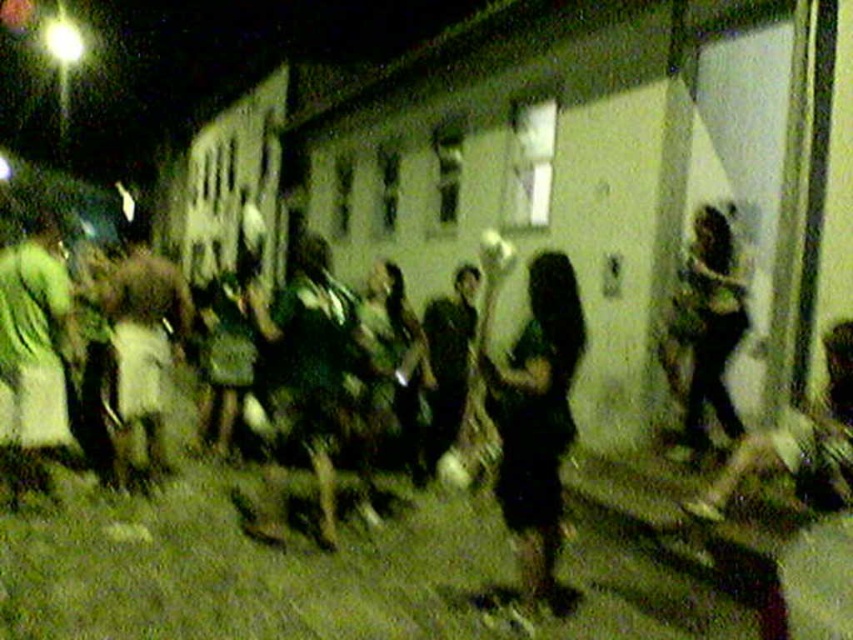
Question: Does green fabric dress at left have a smaller size compared to dark green fabric shirt at center?

Choices:
 (A) no
 (B) yes

Answer: (A)

Question: Estimate the real-world distances between objects in this image. Which object is farther from the green fabric shirt at center?

Choices:
 (A) green fabric dress at left
 (B) dark green fabric at center

Answer: (A)

Question: Can you confirm if green fabric shirt at center is positioned to the right of green fabric dress at left?

Choices:
 (A) no
 (B) yes

Answer: (B)

Question: Which object is farther from the camera taking this photo?

Choices:
 (A) green fabric shirt at center
 (B) dark green fabric at center
 (C) brown fabric shorts at left

Answer: (C)

Question: Is green fabric shirt at center wider than green fabric dress at left?

Choices:
 (A) no
 (B) yes

Answer: (A)

Question: Considering the real-world distances, which object is closest to the dark green fabric dress at right?

Choices:
 (A) green fabric dress at left
 (B) dark green fabric at center
 (C) brown fabric shorts at left

Answer: (B)